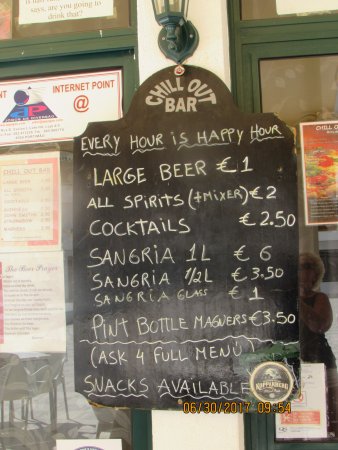
You are a GUI agent. You are given a task and a screenshot of the screen. Output one action in this format:
    pyautogui.click(x=<x>, y=<y>)
    Task: Click on the black chalkboard
    The image size is (338, 450).
    Given the screenshot: What is the action you would take?
    pyautogui.click(x=224, y=239)